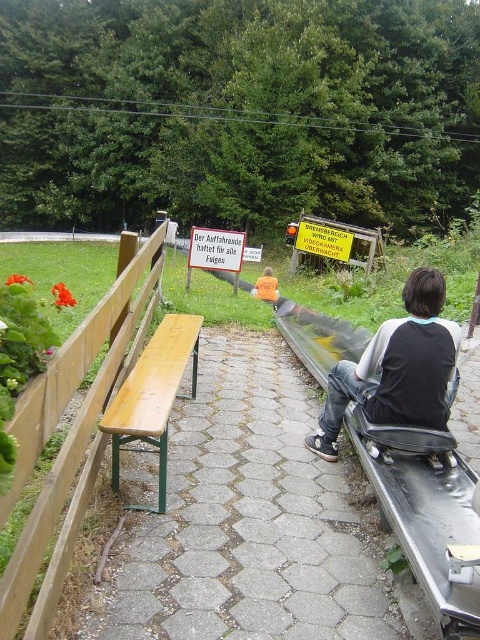
From the picture: Can you confirm if light brown wood bench at left is taller than yellow plastic sign at center?

No, light brown wood bench at left is not taller than yellow plastic sign at center.

Is light brown wood bench at left above yellow plastic sign at center?

No.

Which is in front, point (119, 412) or point (348, 234)?

Point (119, 412) is in front.

Find the location of a particular element. The image size is (480, 640). light brown wood bench at left is located at coordinates pyautogui.click(x=153, y=396).

Can you confirm if yellow plastic sign at center is taller than orange fabric shirt at center?

Indeed, yellow plastic sign at center has a greater height compared to orange fabric shirt at center.

At what (x,y) coordinates should I click in order to perform the action: click on yellow plastic sign at center. Please return your answer as a coordinate pair (x, y). The height and width of the screenshot is (640, 480). Looking at the image, I should click on click(x=324, y=241).

Image resolution: width=480 pixels, height=640 pixels. What are the coordinates of `yellow plastic sign at center` in the screenshot? It's located at (324, 241).

Which of these two, black leather jacket at center or light brown wood bench at left, stands shorter?

light brown wood bench at left is shorter.

Does black leather jacket at center appear on the right side of light brown wood bench at left?

Indeed, black leather jacket at center is positioned on the right side of light brown wood bench at left.

Is point (408, 284) positioned after point (126, 440)?

Yes, it is.

This screenshot has width=480, height=640. What are the coordinates of `black leather jacket at center` in the screenshot? It's located at (396, 369).